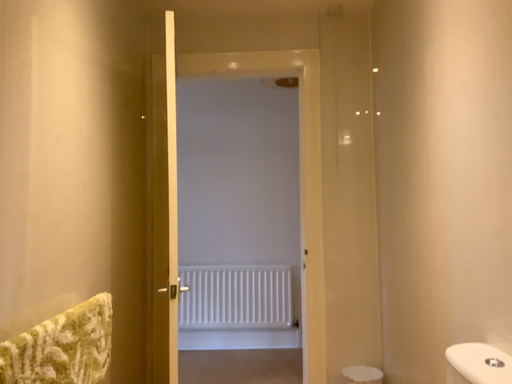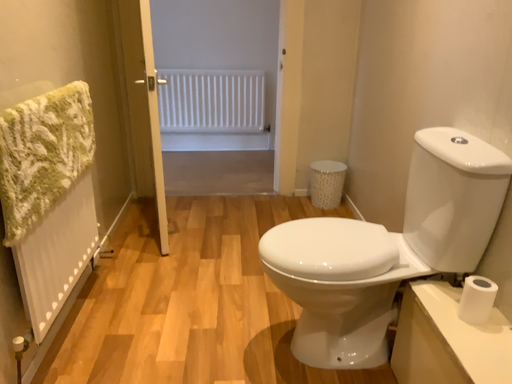
Question: Which way did the camera rotate in the video?

Choices:
 (A) rotated upward
 (B) rotated downward

Answer: (B)